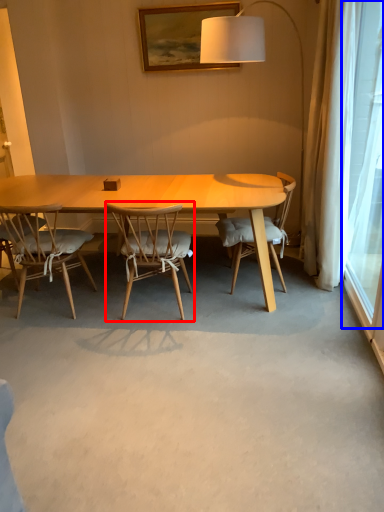
Question: Which object appears farthest to the camera in this image, chair (highlighted by a red box) or window screen (highlighted by a blue box)?

Choices:
 (A) chair
 (B) window screen

Answer: (A)